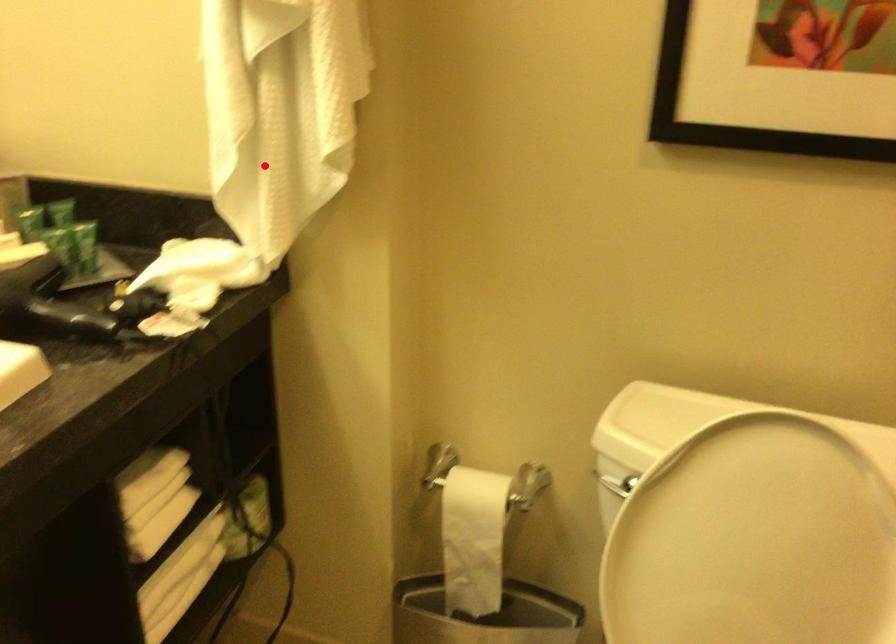
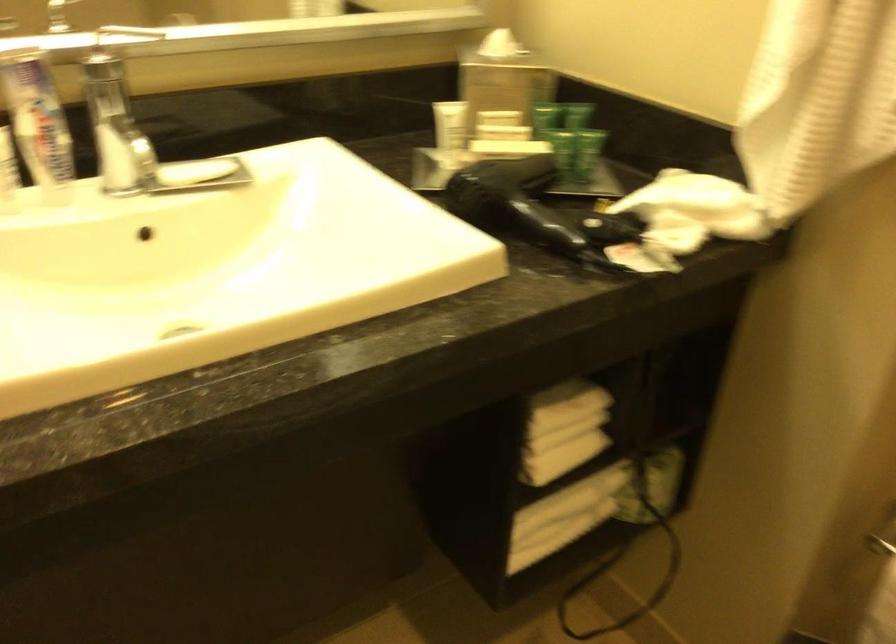
Question: I am providing you with two images of the same scene from different viewpoints. A red point is marked on the first image. Is the red point's position out of view in image 2?

Choices:
 (A) Yes
 (B) No

Answer: (B)